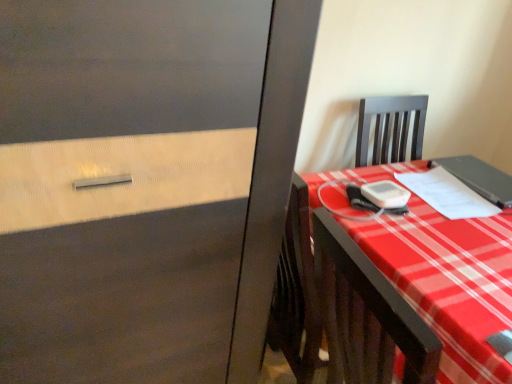
Question: Is plaid fabric desk at right taller than matte black notebook at right, which ranks as the 2th notebook in left-to-right order?

Choices:
 (A) no
 (B) yes

Answer: (B)

Question: Can you see plaid fabric desk at right touching matte black notebook at right, which ranks as the 2th notebook in left-to-right order?

Choices:
 (A) yes
 (B) no

Answer: (B)

Question: Is plaid fabric desk at right facing away from matte black notebook at right, which ranks as the 2th notebook in left-to-right order?

Choices:
 (A) yes
 (B) no

Answer: (B)

Question: Is plaid fabric desk at right outside matte black notebook at right, which is counted as the first notebook, starting from the right?

Choices:
 (A) no
 (B) yes

Answer: (B)

Question: Is plaid fabric desk at right not near matte black notebook at right, which ranks as the 2th notebook in left-to-right order?

Choices:
 (A) no
 (B) yes

Answer: (A)

Question: Considering the relative sizes of plaid fabric desk at right and matte black notebook at right, which ranks as the 2th notebook in left-to-right order, in the image provided, is plaid fabric desk at right thinner than matte black notebook at right, which ranks as the 2th notebook in left-to-right order,?

Choices:
 (A) yes
 (B) no

Answer: (B)

Question: Can you confirm if white paper at right, arranged as the 1th notebook when viewed from the left, is thinner than plaid fabric desk at right?

Choices:
 (A) no
 (B) yes

Answer: (B)

Question: From the image's perspective, would you say white paper at right, arranged as the 1th notebook when viewed from the left, is shown under plaid fabric desk at right?

Choices:
 (A) yes
 (B) no

Answer: (B)

Question: Are white paper at right, arranged as the 1th notebook when viewed from the left, and plaid fabric desk at right making contact?

Choices:
 (A) no
 (B) yes

Answer: (A)

Question: Does white paper at right, marked as the second notebook in a right-to-left arrangement, lie behind plaid fabric desk at right?

Choices:
 (A) no
 (B) yes

Answer: (B)

Question: Is white paper at right, marked as the second notebook in a right-to-left arrangement, not inside plaid fabric desk at right?

Choices:
 (A) no
 (B) yes

Answer: (A)

Question: From a real-world perspective, is white paper at right, marked as the second notebook in a right-to-left arrangement, over plaid fabric desk at right?

Choices:
 (A) yes
 (B) no

Answer: (A)

Question: Does matte black notebook at right, which is counted as the first notebook, starting from the right, appear on the right side of plaid fabric desk at right?

Choices:
 (A) no
 (B) yes

Answer: (B)